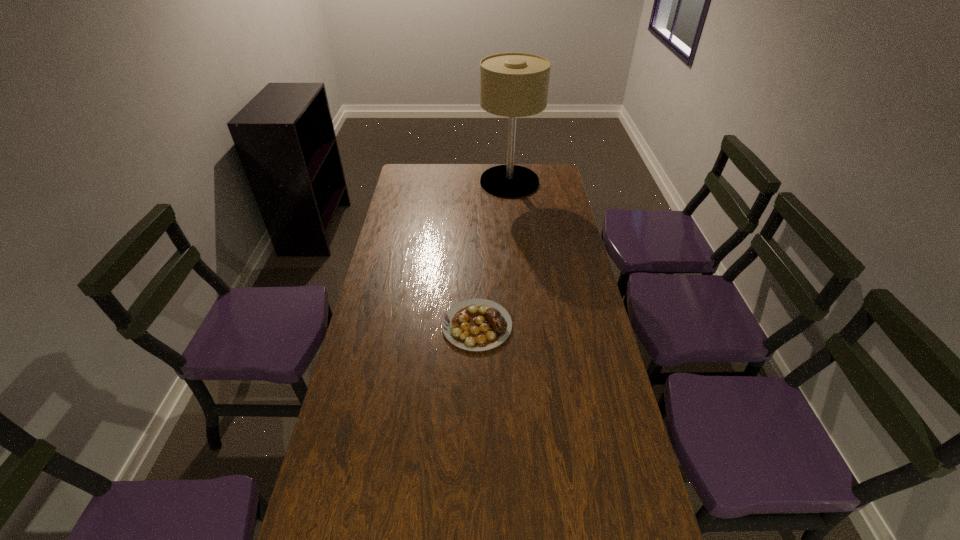
Locate an element on the screen. This screenshot has height=540, width=960. the taller object is located at coordinates (513, 85).

Locate an element on the screen. This screenshot has width=960, height=540. table lamp is located at coordinates (513, 85).

Identify the location of steak. This screenshot has height=540, width=960. (476, 324).

Identify the location of the nearer object. (476, 324).

You are a GUI agent. You are given a task and a screenshot of the screen. Output one action in this format:
    pyautogui.click(x=<x>, y=<y>)
    Task: Click on the vacant space located 0.390m on the left of the taller object
    
    Given the screenshot: What is the action you would take?
    pyautogui.click(x=400, y=182)

I want to click on free spot located on the right of the steak, so click(x=593, y=326).

Identify the location of object positioned at the far edge. (513, 85).

What are the coordinates of `object that is at the right edge` in the screenshot? It's located at (513, 85).

You are a GUI agent. You are given a task and a screenshot of the screen. Output one action in this format:
    pyautogui.click(x=<x>, y=<y>)
    Task: Click on the object situated at the far right corner
    This screenshot has width=960, height=540.
    Given the screenshot: What is the action you would take?
    pyautogui.click(x=513, y=85)

The height and width of the screenshot is (540, 960). In the image, there is a desktop. Find the location of `vacant region at the left edge`. vacant region at the left edge is located at coordinates (402, 246).